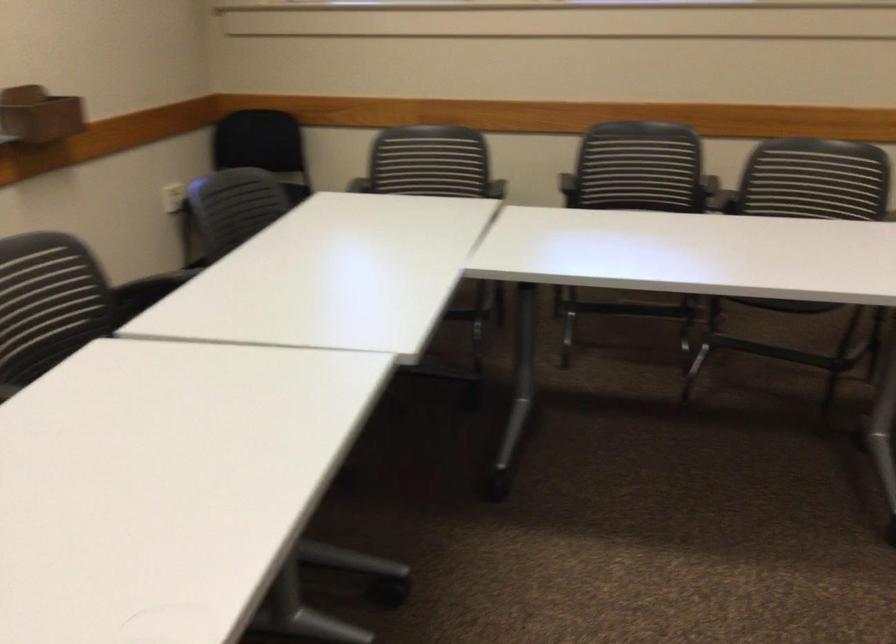
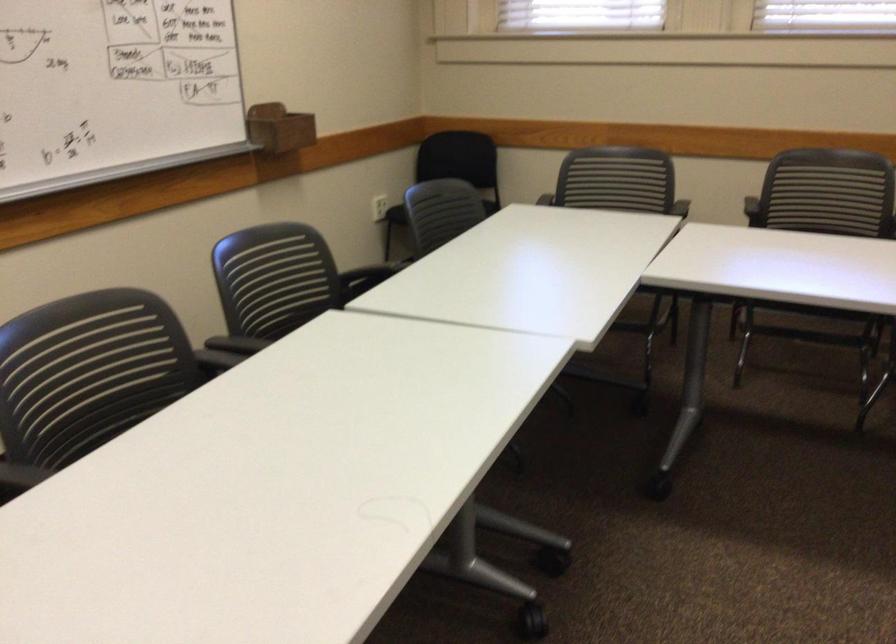
The point at (243,204) is marked in the first image. Where is the corresponding point in the second image?

(441, 212)